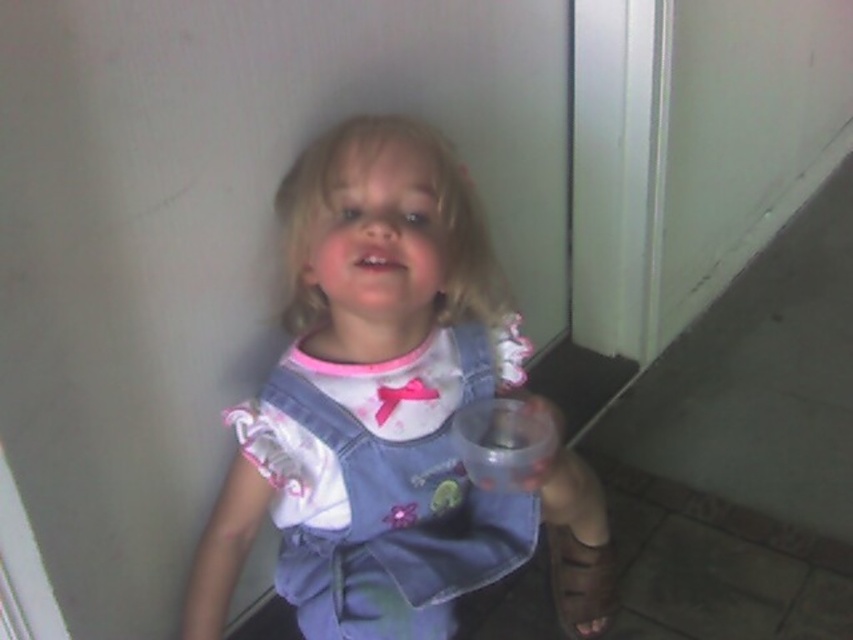
You are helping a child choose between two outfits. The child is currently wearing the denim dress at center and the denim overalls at center. The parent says they want the wider item for comfort. Which item should you pick?

The denim overalls at center should be chosen because its width surpasses that of the denim dress at center, making it wider and more comfortable.

The child is wearing two items of clothing at the center of the image. Which one is taller, the denim overalls at center or the denim dress at center?

The denim overalls at center is taller than the denim dress at center according to the description.

You are a delivery robot in a house. You need to deliver a package to a point that is exactly at coordinates point (393, 168). The robot has a maximum delivery range of 36 inches. Can you reach that point?

Result: The distance of point (393, 168) from camera is 36.39 inches, so the robot cannot reach it as it exceeds the maximum range of 36 inches.